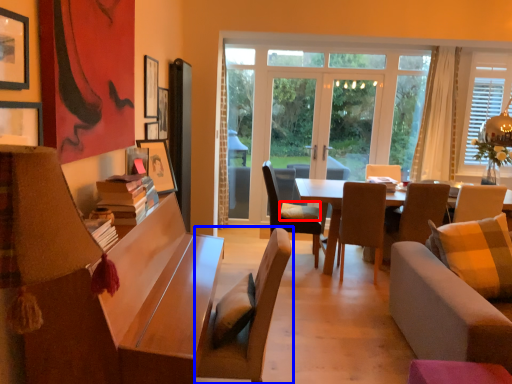
Question: Which point is further to the camera, pillow (highlighted by a red box) or chair (highlighted by a blue box)?

Choices:
 (A) pillow
 (B) chair

Answer: (A)